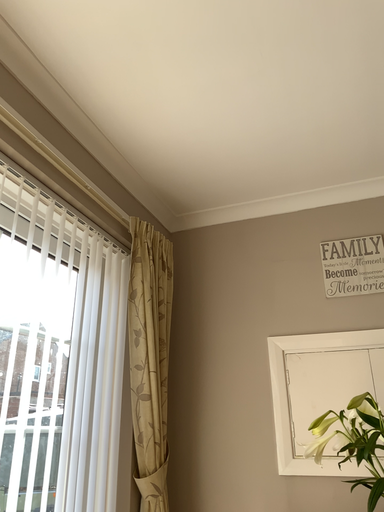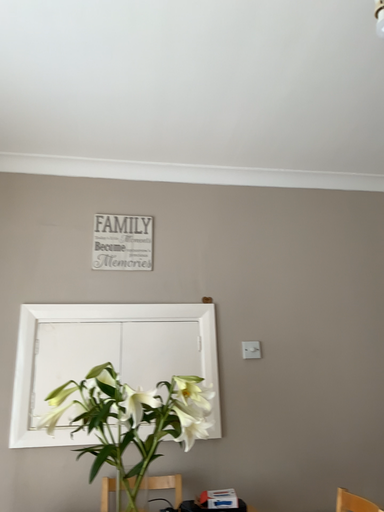
Question: Which way did the camera rotate in the video?

Choices:
 (A) rotated downward
 (B) rotated upward

Answer: (A)